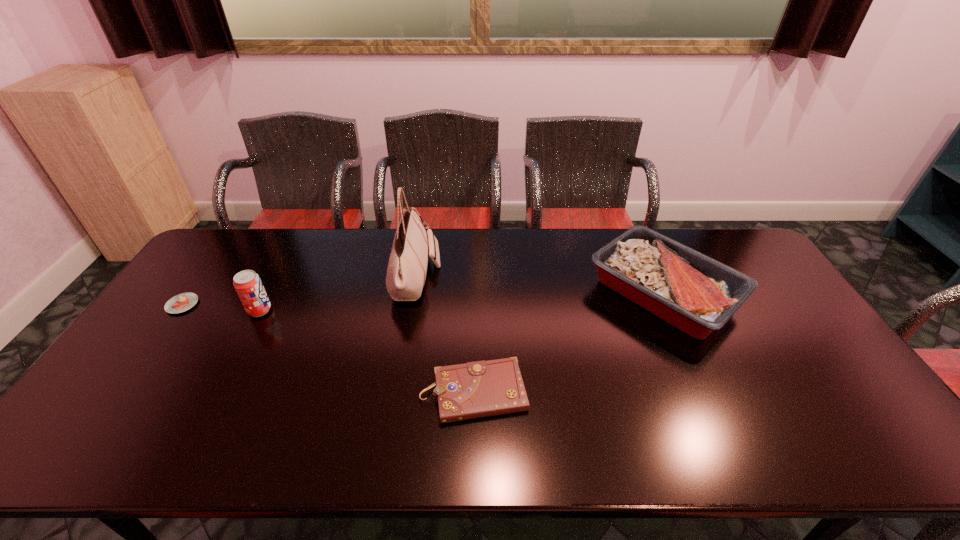
Locate an element on the screen. Image resolution: width=960 pixels, height=540 pixels. free space between the second shortest object and the second object from left to right is located at coordinates (367, 352).

Locate which object ranks third in proximity to the tallest object. Please provide its 2D coordinates. Your answer should be formatted as a tuple, i.e. [(x, y)], where the tuple contains the x and y coordinates of a point satisfying the conditions above.

[(697, 294)]

Locate an element on the screen. This screenshot has height=540, width=960. object that stands as the second closest to the tallest object is located at coordinates (248, 285).

Find the location of a particular element. The width and height of the screenshot is (960, 540). vacant space that satisfies the following two spatial constraints: 1. on the side of the tallest object with the attached pouch; 2. on the right side of the rightmost object is located at coordinates (414, 293).

You are a GUI agent. You are given a task and a screenshot of the screen. Output one action in this format:
    pyautogui.click(x=<x>, y=<y>)
    Task: Click on the free space that satisfies the following two spatial constraints: 1. on the side of the tallest object with the attached pouch; 2. on the left side of the notebook
    
    Given the screenshot: What is the action you would take?
    pyautogui.click(x=396, y=392)

The width and height of the screenshot is (960, 540). What are the coordinates of `vacant space that satisfies the following two spatial constraints: 1. on the side of the tallest object with the attached pouch; 2. on the front side of the leftmost object` in the screenshot? It's located at (412, 305).

Locate an element on the screen. This screenshot has width=960, height=540. free location that satisfies the following two spatial constraints: 1. on the back side of the tray; 2. on the side of the tallest object with the attached pouch is located at coordinates (657, 277).

Locate an element on the screen. The image size is (960, 540). vacant region that satisfies the following two spatial constraints: 1. on the side of the tallest object with the attached pouch; 2. on the front side of the leftmost object is located at coordinates (412, 305).

In order to click on free location that satisfies the following two spatial constraints: 1. on the side of the tallest object with the attached pouch; 2. on the back side of the notebook in this screenshot , I will do `click(396, 392)`.